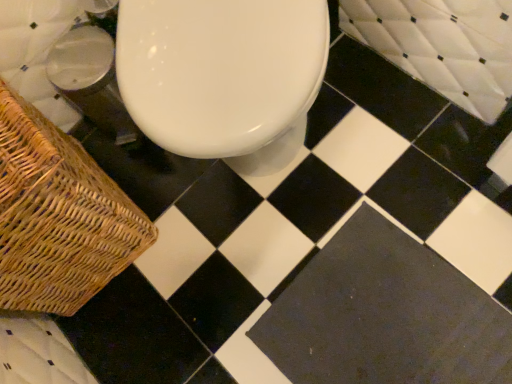
Question: From the image's perspective, would you say white quilted bath at upper right is positioned over woven brown picnic basket at lower left?

Choices:
 (A) yes
 (B) no

Answer: (A)

Question: Is woven brown picnic basket at lower left inside white quilted bath at upper right?

Choices:
 (A) yes
 (B) no

Answer: (B)

Question: Considering the relative positions of white quilted bath at upper right and woven brown picnic basket at lower left in the image provided, is white quilted bath at upper right to the left of woven brown picnic basket at lower left from the viewer's perspective?

Choices:
 (A) yes
 (B) no

Answer: (B)

Question: Is white quilted bath at upper right bigger than woven brown picnic basket at lower left?

Choices:
 (A) yes
 (B) no

Answer: (B)

Question: Is white quilted bath at upper right facing towards woven brown picnic basket at lower left?

Choices:
 (A) no
 (B) yes

Answer: (B)

Question: Does white quilted bath at upper right come behind woven brown picnic basket at lower left?

Choices:
 (A) yes
 (B) no

Answer: (A)

Question: Considering the relative sizes of woven brown picnic basket at lower left and white quilted bath at upper right in the image provided, is woven brown picnic basket at lower left shorter than white quilted bath at upper right?

Choices:
 (A) no
 (B) yes

Answer: (A)

Question: Does woven brown picnic basket at lower left have a greater height compared to white quilted bath at upper right?

Choices:
 (A) yes
 (B) no

Answer: (A)

Question: Does woven brown picnic basket at lower left come in front of white quilted bath at upper right?

Choices:
 (A) no
 (B) yes

Answer: (B)

Question: Would you consider woven brown picnic basket at lower left to be distant from white quilted bath at upper right?

Choices:
 (A) no
 (B) yes

Answer: (A)

Question: Is woven brown picnic basket at lower left placed right next to white quilted bath at upper right?

Choices:
 (A) yes
 (B) no

Answer: (B)

Question: Is woven brown picnic basket at lower left positioned beyond the bounds of white quilted bath at upper right?

Choices:
 (A) yes
 (B) no

Answer: (A)

Question: Can you confirm if white quilted bath at upper right is shorter than black matte tile at center?

Choices:
 (A) no
 (B) yes

Answer: (A)